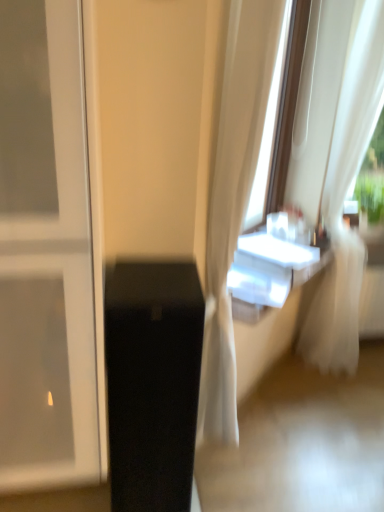
The height and width of the screenshot is (512, 384). I want to click on black glossy speaker at lower left, so click(x=152, y=382).

Describe the element at coordinates (152, 382) in the screenshot. I see `black glossy speaker at lower left` at that location.

This screenshot has height=512, width=384. Find the location of `white sheer curtain at right`. white sheer curtain at right is located at coordinates (343, 202).

This screenshot has width=384, height=512. What do you see at coordinates (343, 202) in the screenshot?
I see `white sheer curtain at right` at bounding box center [343, 202].

The image size is (384, 512). In order to click on black glossy speaker at lower left in this screenshot , I will do pyautogui.click(x=152, y=382).

Which is more to the right, white sheer curtain at right or black glossy speaker at lower left?

From the viewer's perspective, white sheer curtain at right appears more on the right side.

Considering the positions of objects white sheer curtain at right and black glossy speaker at lower left in the image provided, who is behind, white sheer curtain at right or black glossy speaker at lower left?

Positioned behind is white sheer curtain at right.

Is point (350, 316) positioned behind point (203, 327)?

Yes, point (350, 316) is farther from viewer.

From the image's perspective, is white sheer curtain at right positioned above or below black glossy speaker at lower left?

From the image's perspective, white sheer curtain at right appears above black glossy speaker at lower left.

From a real-world perspective, which object rests below the other?

In real-world perspective, black glossy speaker at lower left is lower.

From the picture: Does white sheer curtain at right have a greater width compared to black glossy speaker at lower left?

Incorrect, the width of white sheer curtain at right does not surpass that of black glossy speaker at lower left.

In terms of height, does white sheer curtain at right look taller or shorter compared to black glossy speaker at lower left?

In the image, white sheer curtain at right appears to be taller than black glossy speaker at lower left.

Considering the relative sizes of white sheer curtain at right and black glossy speaker at lower left in the image provided, is white sheer curtain at right smaller than black glossy speaker at lower left?

No.

Is white sheer curtain at right positioned beyond the bounds of black glossy speaker at lower left?

Absolutely, white sheer curtain at right is external to black glossy speaker at lower left.

Is white sheer curtain at right next to black glossy speaker at lower left?

No, white sheer curtain at right is not with black glossy speaker at lower left.

Is white sheer curtain at right aimed at black glossy speaker at lower left?

No, white sheer curtain at right is not turned towards black glossy speaker at lower left.

Locate an element on the screen. curtain on the right side of black glossy speaker at lower left is located at coordinates (343, 202).

From the picture: Is black glossy speaker at lower left to the left of white sheer curtain at right from the viewer's perspective?

Correct, you'll find black glossy speaker at lower left to the left of white sheer curtain at right.

Relative to white sheer curtain at right, is black glossy speaker at lower left in front or behind?

In the image, black glossy speaker at lower left appears in front of white sheer curtain at right.

Which point is more distant from viewer, (x=186, y=409) or (x=299, y=347)?

Point (x=299, y=347)

From the image's perspective, is black glossy speaker at lower left located above white sheer curtain at right?

No.

From a real-world perspective, is black glossy speaker at lower left beneath white sheer curtain at right?

Indeed, from a real-world perspective, black glossy speaker at lower left is positioned beneath white sheer curtain at right.

Considering the sizes of objects black glossy speaker at lower left and white sheer curtain at right in the image provided, who is wider, black glossy speaker at lower left or white sheer curtain at right?

With larger width is black glossy speaker at lower left.

Does black glossy speaker at lower left have a lesser height compared to white sheer curtain at right?

Yes.

From the picture: Considering the sizes of objects black glossy speaker at lower left and white sheer curtain at right in the image provided, who is bigger, black glossy speaker at lower left or white sheer curtain at right?

With larger size is white sheer curtain at right.

Is black glossy speaker at lower left inside the boundaries of white sheer curtain at right, or outside?

black glossy speaker at lower left is not enclosed by white sheer curtain at right.

Are black glossy speaker at lower left and white sheer curtain at right beside each other?

They are not placed beside each other.

Is white sheer curtain at right at the back of black glossy speaker at lower left?

black glossy speaker at lower left does not have its back to white sheer curtain at right.

How different are the orientations of black glossy speaker at lower left and white sheer curtain at right in degrees?

The angle between the facing direction of black glossy speaker at lower left and the facing direction of white sheer curtain at right is 30 degrees.

Where is `curtain above the black glossy speaker at lower left (from the image's perspective)`? curtain above the black glossy speaker at lower left (from the image's perspective) is located at coordinates (343, 202).

This screenshot has width=384, height=512. Identify the location of furniture below the white sheer curtain at right (from a real-world perspective). (152, 382).

The image size is (384, 512). Find the location of `curtain above the black glossy speaker at lower left (from a real-world perspective)`. curtain above the black glossy speaker at lower left (from a real-world perspective) is located at coordinates (343, 202).